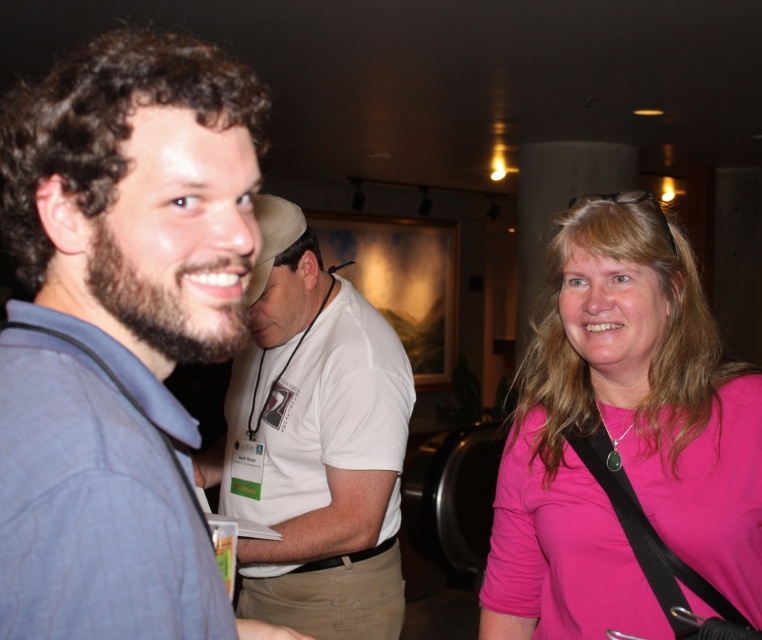
Is blue plaid shirt at left above pink matte shirt at upper right?

Yes.

Is blue plaid shirt at left to the right of pink matte shirt at upper right from the viewer's perspective?

In fact, blue plaid shirt at left is to the left of pink matte shirt at upper right.

Is point (93, 410) positioned after point (559, 408)?

No.

Image resolution: width=762 pixels, height=640 pixels. I want to click on blue plaid shirt at left, so click(x=136, y=202).

Which is behind, point (623, 385) or point (59, 330)?

Positioned behind is point (623, 385).

Consider the image. Between pink matte shirt at upper right and blue cotton shirt at left, which one appears on the right side from the viewer's perspective?

pink matte shirt at upper right is more to the right.

Is point (655, 612) less distant than point (184, 588)?

No, (655, 612) is behind (184, 588).

This screenshot has width=762, height=640. In order to click on pink matte shirt at upper right in this screenshot , I will do `click(626, 444)`.

Which is below, blue plaid shirt at left or white cotton shirt at center?

white cotton shirt at center

Where is `blue plaid shirt at left`? Image resolution: width=762 pixels, height=640 pixels. blue plaid shirt at left is located at coordinates (136, 202).

Is point (111, 58) positioned behind point (325, 394)?

No.

Where is `blue plaid shirt at left`? Image resolution: width=762 pixels, height=640 pixels. blue plaid shirt at left is located at coordinates (136, 202).